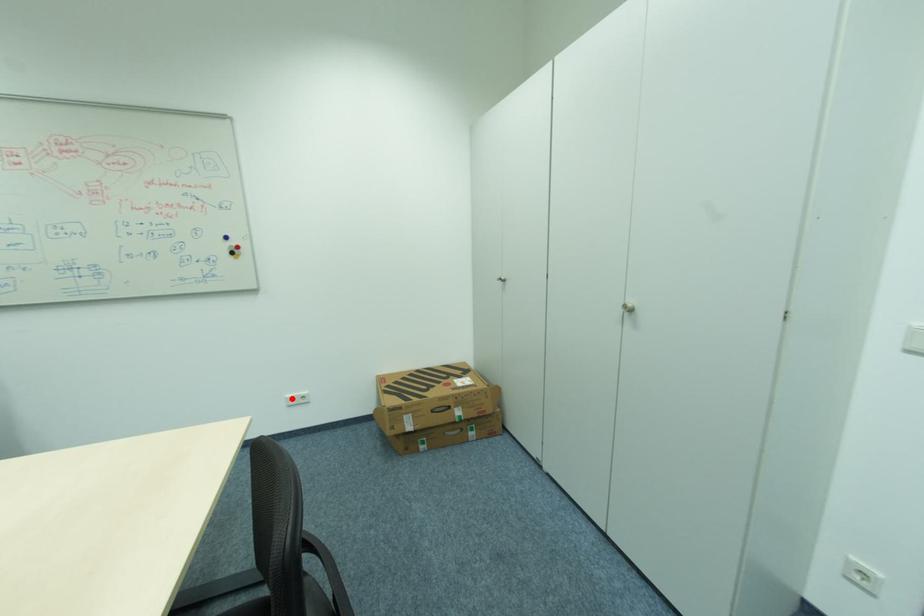
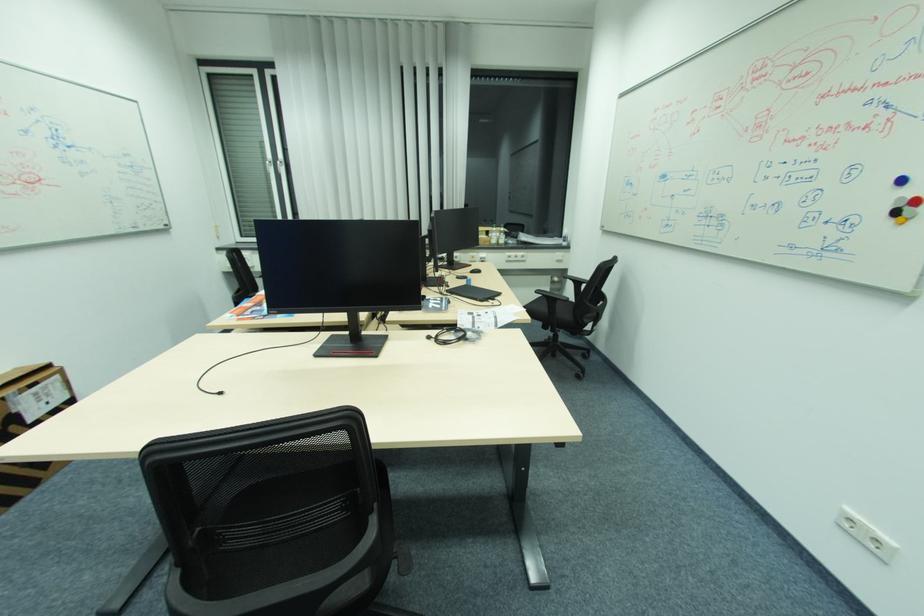
Where in the second image is the point corresponding to the highlighted location from the first image?

(848, 511)